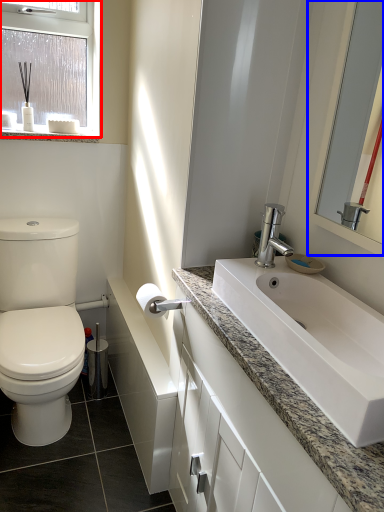
Question: Which object is further to the camera taking this photo, window (highlighted by a red box) or mirror (highlighted by a blue box)?

Choices:
 (A) window
 (B) mirror

Answer: (A)